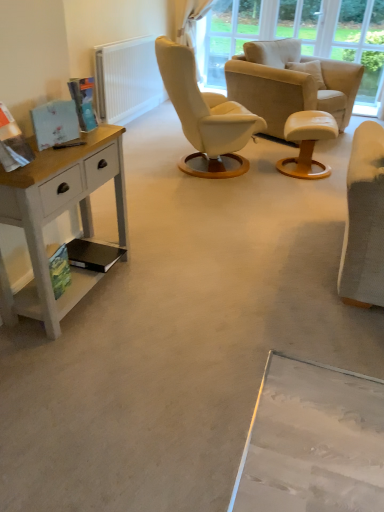
Identify the location of vacant position to the left of white leather stool at center. Image resolution: width=384 pixels, height=512 pixels. (257, 175).